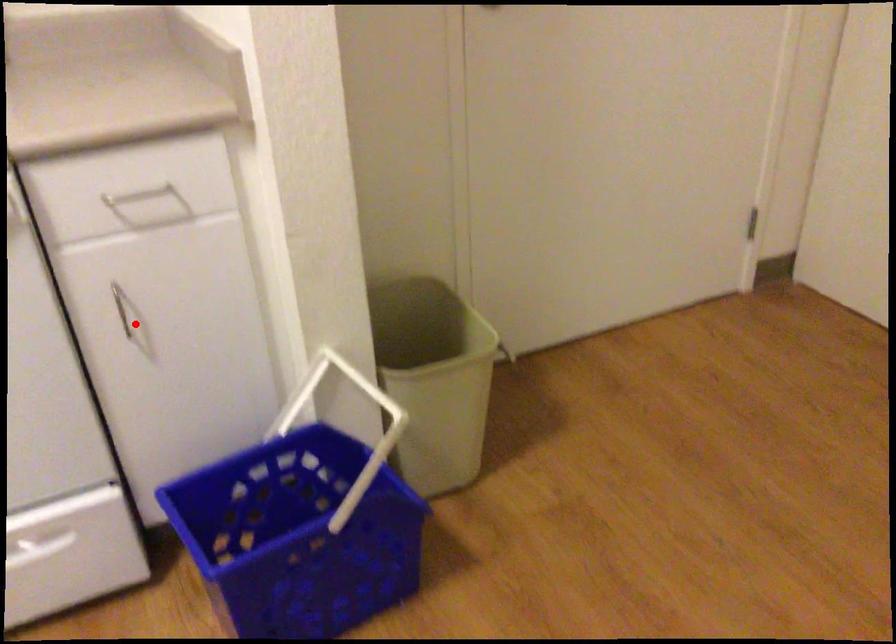
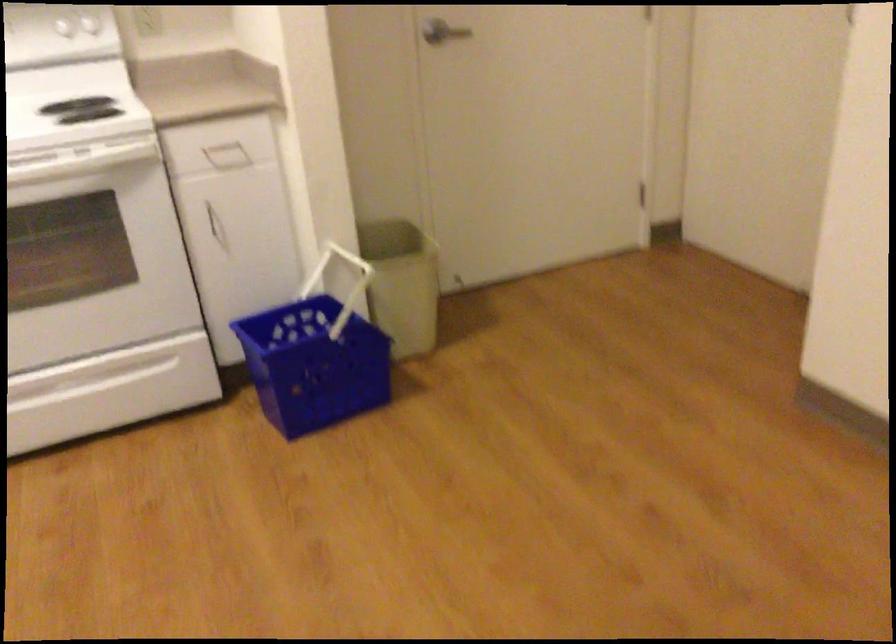
Question: I am providing you with two images of the same scene from different viewpoints. In image1, a red point is highlighted. Considering the same 3D point in image2, which of the following is correct?

Choices:
 (A) It is closer
 (B) It is farther

Answer: (B)